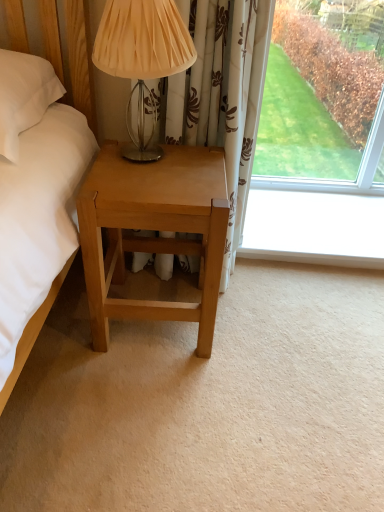
Measure the distance between point [124,6] and camera.

Point [124,6] is 36.18 inches away from camera.

What do you see at coordinates (142, 56) in the screenshot?
I see `matte beige fabric at upper center` at bounding box center [142, 56].

Find the location of a particular element. matte beige fabric at upper center is located at coordinates (142, 56).

The image size is (384, 512). What are the coordinates of `light brown wood nightstand at lower left` in the screenshot? It's located at [x=153, y=238].

The height and width of the screenshot is (512, 384). What do you see at coordinates (153, 238) in the screenshot?
I see `light brown wood nightstand at lower left` at bounding box center [153, 238].

Identify the location of matte beige fabric at upper center. The image size is (384, 512). (142, 56).

Considering the relative positions of light brown wood nightstand at lower left and matte beige fabric at upper center in the image provided, is light brown wood nightstand at lower left to the right of matte beige fabric at upper center from the viewer's perspective?

Indeed, light brown wood nightstand at lower left is positioned on the right side of matte beige fabric at upper center.

Which object is further away from the camera, light brown wood nightstand at lower left or matte beige fabric at upper center?

light brown wood nightstand at lower left is behind.

Is point (82, 201) closer or farther from the camera than point (155, 119)?

Point (82, 201) appears to be closer to the viewer than point (155, 119).

From the image's perspective, between light brown wood nightstand at lower left and matte beige fabric at upper center, who is located below?

light brown wood nightstand at lower left.

From a real-world perspective, does light brown wood nightstand at lower left stand above matte beige fabric at upper center?

No, from a real-world perspective, light brown wood nightstand at lower left is not over matte beige fabric at upper center

Considering the relative sizes of light brown wood nightstand at lower left and matte beige fabric at upper center in the image provided, is light brown wood nightstand at lower left wider than matte beige fabric at upper center?

Indeed, light brown wood nightstand at lower left has a greater width compared to matte beige fabric at upper center.

Is light brown wood nightstand at lower left taller or shorter than matte beige fabric at upper center?

Considering their sizes, light brown wood nightstand at lower left has more height than matte beige fabric at upper center.

Which of these two, light brown wood nightstand at lower left or matte beige fabric at upper center, is bigger?

Bigger between the two is light brown wood nightstand at lower left.

In the scene shown: Can we say light brown wood nightstand at lower left lies outside matte beige fabric at upper center?

light brown wood nightstand at lower left lies outside matte beige fabric at upper center's area.

Is light brown wood nightstand at lower left in contact with matte beige fabric at upper center?

No, light brown wood nightstand at lower left is not making contact with matte beige fabric at upper center.

Is matte beige fabric at upper center at the back of light brown wood nightstand at lower left?

light brown wood nightstand at lower left does not have its back to matte beige fabric at upper center.

Find the location of `nightstand on the right of matte beige fabric at upper center`. nightstand on the right of matte beige fabric at upper center is located at coordinates (153, 238).

In the image, is matte beige fabric at upper center on the left side or the right side of light brown wood nightstand at lower left?

In the image, matte beige fabric at upper center appears on the left side of light brown wood nightstand at lower left.

Considering the positions of objects matte beige fabric at upper center and light brown wood nightstand at lower left in the image provided, who is behind, matte beige fabric at upper center or light brown wood nightstand at lower left?

light brown wood nightstand at lower left is further from the camera.

Which is behind, point (138, 70) or point (147, 173)?

The point (147, 173) is farther from the camera.

From the image's perspective, is matte beige fabric at upper center located above or below light brown wood nightstand at lower left?

Based on their image positions, matte beige fabric at upper center is located above light brown wood nightstand at lower left.

From a real-world perspective, between matte beige fabric at upper center and light brown wood nightstand at lower left, who is vertically higher?

matte beige fabric at upper center, from a real-world perspective.

Between matte beige fabric at upper center and light brown wood nightstand at lower left, which one has larger width?

With larger width is light brown wood nightstand at lower left.

Considering the sizes of objects matte beige fabric at upper center and light brown wood nightstand at lower left in the image provided, who is taller, matte beige fabric at upper center or light brown wood nightstand at lower left?

light brown wood nightstand at lower left is taller.

Which of these two, matte beige fabric at upper center or light brown wood nightstand at lower left, is bigger?

Bigger between the two is light brown wood nightstand at lower left.

Is matte beige fabric at upper center positioned beyond the bounds of light brown wood nightstand at lower left?

Yes, matte beige fabric at upper center is outside of light brown wood nightstand at lower left.

Are matte beige fabric at upper center and light brown wood nightstand at lower left far apart?

No, matte beige fabric at upper center is in close proximity to light brown wood nightstand at lower left.

Is matte beige fabric at upper center facing away from light brown wood nightstand at lower left?

That's not correct — matte beige fabric at upper center is not looking away from light brown wood nightstand at lower left.

At what (x,y) coordinates should I click in order to perform the action: click on nightstand lying on the right of matte beige fabric at upper center. Please return your answer as a coordinate pair (x, y). Looking at the image, I should click on (153, 238).

I want to click on table lamp above the light brown wood nightstand at lower left (from a real-world perspective), so click(142, 56).

Image resolution: width=384 pixels, height=512 pixels. I want to click on table lamp in front of the light brown wood nightstand at lower left, so click(142, 56).